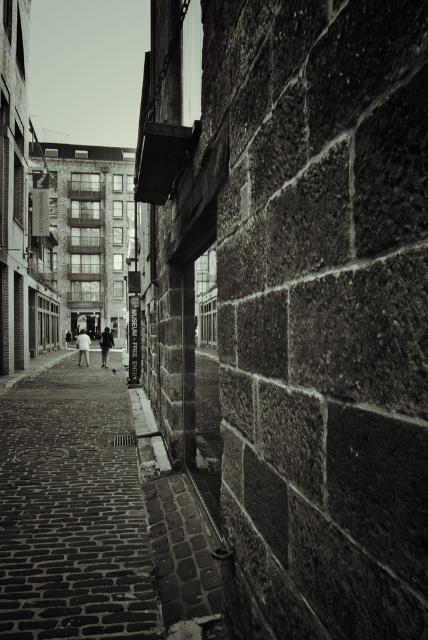
Does smooth cobblestone pavement at center have a lesser width compared to white cotton shirt at center?

Yes.

Is smooth cobblestone pavement at center in front of white cotton shirt at center?

Yes, it is.

Image resolution: width=428 pixels, height=640 pixels. Identify the location of smooth cobblestone pavement at center. (73, 509).

Image resolution: width=428 pixels, height=640 pixels. Find the location of `white cotton shirt at center`. white cotton shirt at center is located at coordinates (83, 346).

Does white cotton shirt at center have a larger size compared to dark gray fabric jacket at center?

Correct, white cotton shirt at center is larger in size than dark gray fabric jacket at center.

Measure the distance between white cotton shirt at center and camera.

white cotton shirt at center and camera are 27.81 meters apart.

At what (x,y) coordinates should I click in order to perform the action: click on white cotton shirt at center. Please return your answer as a coordinate pair (x, y). The width and height of the screenshot is (428, 640). Looking at the image, I should click on (83, 346).

Is point (58, 525) positioned before point (104, 356)?

Yes, point (58, 525) is closer to viewer.

Can you confirm if smooth cobblestone pavement at center is thinner than dark gray fabric jacket at center?

No, smooth cobblestone pavement at center is not thinner than dark gray fabric jacket at center.

Describe the element at coordinates (73, 509) in the screenshot. I see `smooth cobblestone pavement at center` at that location.

Identify the location of smooth cobblestone pavement at center. The image size is (428, 640). (73, 509).